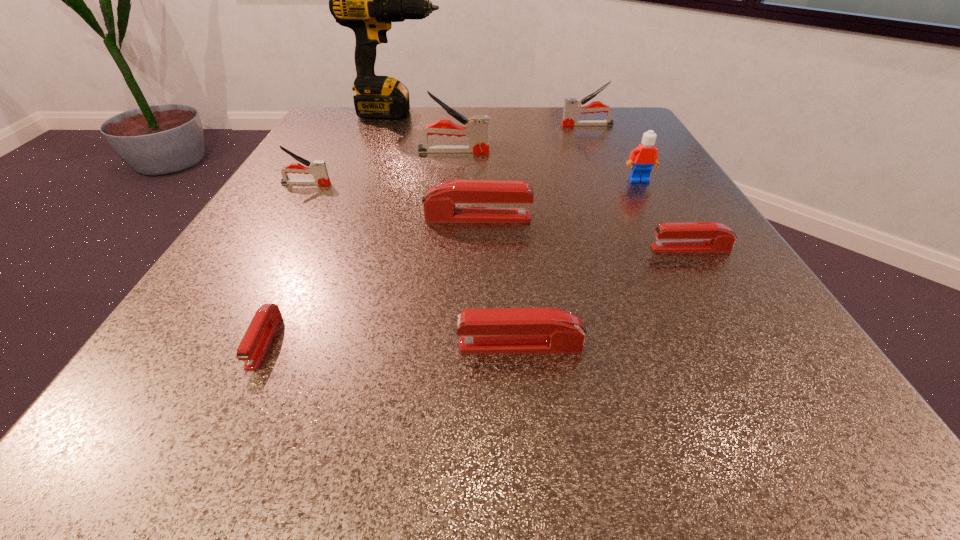
Where is `vacant area that lies between the drill and the seventh tallest object`? vacant area that lies between the drill and the seventh tallest object is located at coordinates (459, 230).

Locate an element on the screen. Image resolution: width=960 pixels, height=540 pixels. empty space between the tallest object and the farthest gray stapler is located at coordinates (492, 119).

Identify the location of vacant space in between the third shortest stapler and the tallest stapler. The height and width of the screenshot is (540, 960). (487, 248).

Where is `free space between the second tallest stapler and the seventh tallest object`? free space between the second tallest stapler and the seventh tallest object is located at coordinates (554, 235).

Identify the location of object that is the third closest to the white Lego. This screenshot has width=960, height=540. (572, 107).

Locate an element on the screen. This screenshot has height=540, width=960. object that is the third nearest to the leftmost stapler is located at coordinates (366, 0).

Select which stapler appears as the seventh closest to the white Lego. Please provide its 2D coordinates. Your answer should be formatted as a tuple, i.e. [(x, y)], where the tuple contains the x and y coordinates of a point satisfying the conditions above.

[(253, 345)]

Locate which stapler ranks fifth in proximity to the eighth nearest object. Please provide its 2D coordinates. Your answer should be formatted as a tuple, i.e. [(x, y)], where the tuple contains the x and y coordinates of a point satisfying the conditions above.

[(500, 330)]

Identify the location of gray stapler that is the closest to the Lego. Image resolution: width=960 pixels, height=540 pixels. (572, 107).

Where is `gray stapler object that ranks as the closest to the third smallest red stapler`? gray stapler object that ranks as the closest to the third smallest red stapler is located at coordinates (318, 168).